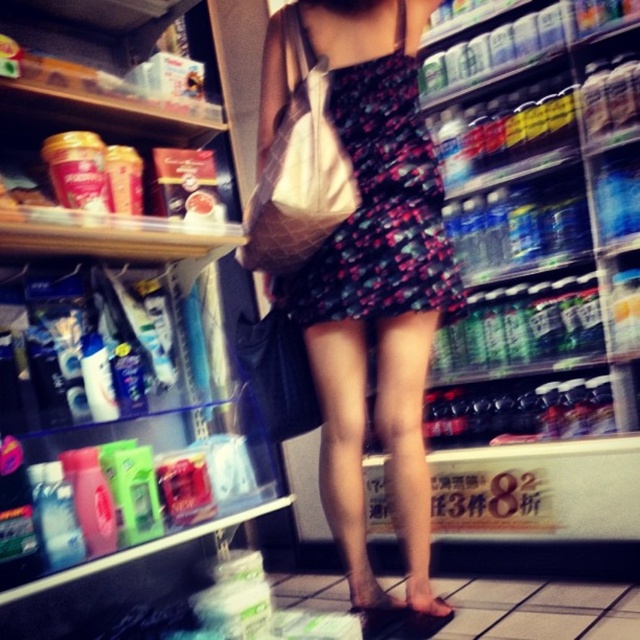
You are a delivery person who needs to place a package between the translucent plastic bottles at left and the brown leather sandal at lower center. Can you fit the package if it is 1.2 meters wide?

The translucent plastic bottles at left are wider than the brown leather sandal at lower center. However, the total width between them isn

Based on the photo, you are a store employee checking the inventory. You notice the translucent plastic bottles at left and the floral dress at center. Which object is wider in terms of physical dimensions?

The translucent plastic bottles at left are wider than the floral dress at center based on their physical dimensions.